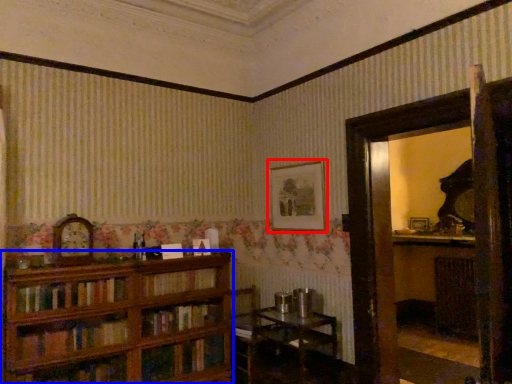
Question: Which object is closer to the camera taking this photo, picture frame (highlighted by a red box) or bookcase (highlighted by a blue box)?

Choices:
 (A) picture frame
 (B) bookcase

Answer: (B)